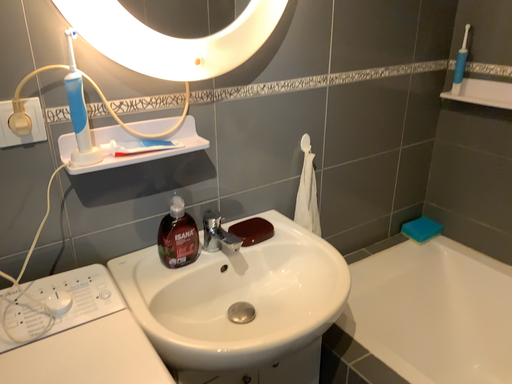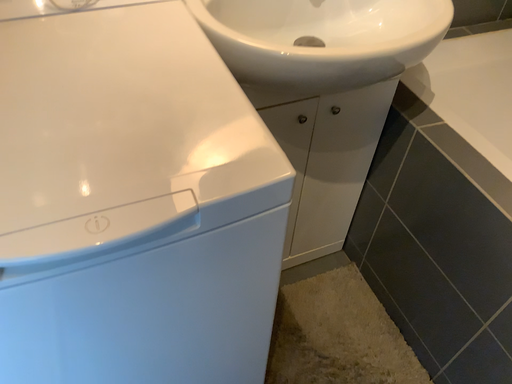
Question: How did the camera likely rotate when shooting the video?

Choices:
 (A) rotated upward
 (B) rotated downward

Answer: (B)